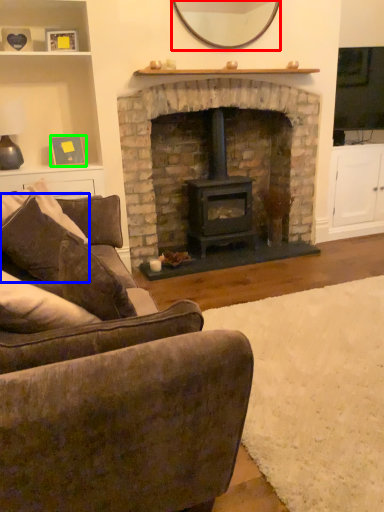
Question: Estimate the real-world distances between objects in this image. Which object is farther from mirror (highlighted by a red box), pillow (highlighted by a blue box) or picture frame (highlighted by a green box)?

Choices:
 (A) pillow
 (B) picture frame

Answer: (A)